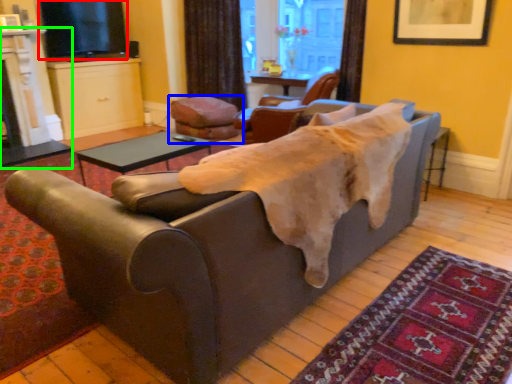
Question: Which is nearer to the window screen (highlighted by a red box)? chair (highlighted by a blue box) or fireplace (highlighted by a green box).

Choices:
 (A) chair
 (B) fireplace

Answer: (B)